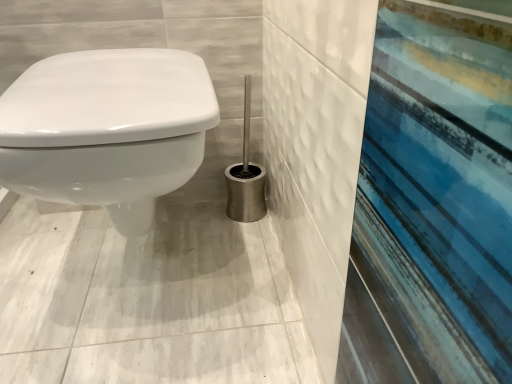
What do you see at coordinates (246, 177) in the screenshot?
I see `satin silver toilet brush at center` at bounding box center [246, 177].

Locate an element on the screen. This screenshot has width=512, height=384. satin silver toilet brush at center is located at coordinates (246, 177).

Where is `white glossy toilet at left`? The width and height of the screenshot is (512, 384). white glossy toilet at left is located at coordinates (106, 129).

In order to face white glossy toilet at left, should I rotate leftwards or rightwards?

Turn left approximately 17.132 degrees to face it.

What do you see at coordinates (106, 129) in the screenshot? Image resolution: width=512 pixels, height=384 pixels. I see `white glossy toilet at left` at bounding box center [106, 129].

The image size is (512, 384). I want to click on satin silver toilet brush at center, so click(246, 177).

From the picture: Considering the relative positions of white glossy toilet at left and satin silver toilet brush at center in the image provided, is white glossy toilet at left to the left of satin silver toilet brush at center from the viewer's perspective?

Yes.

In the image, is white glossy toilet at left positioned in front of or behind satin silver toilet brush at center?

Visually, white glossy toilet at left is located in front of satin silver toilet brush at center.

Considering the points (25, 170) and (246, 136), which point is in front, point (25, 170) or point (246, 136)?

The point (25, 170) is closer to the camera.

From the image's perspective, relative to satin silver toilet brush at center, is white glossy toilet at left above or below?

white glossy toilet at left is situated lower than satin silver toilet brush at center in the image.

From a real-world perspective, is white glossy toilet at left physically below satin silver toilet brush at center?

No, from a real-world perspective, white glossy toilet at left is not below satin silver toilet brush at center.

Between white glossy toilet at left and satin silver toilet brush at center, which one has larger width?

white glossy toilet at left.

Is white glossy toilet at left taller than satin silver toilet brush at center?

Yes.

Does white glossy toilet at left have a smaller size compared to satin silver toilet brush at center?

Actually, white glossy toilet at left might be larger than satin silver toilet brush at center.

Would you say white glossy toilet at left is inside or outside satin silver toilet brush at center?

white glossy toilet at left is located beyond the bounds of satin silver toilet brush at center.

Is white glossy toilet at left with satin silver toilet brush at center?

white glossy toilet at left and satin silver toilet brush at center are clearly separated.

Is white glossy toilet at left turned away from satin silver toilet brush at center?

No, white glossy toilet at left is not facing the opposite direction of satin silver toilet brush at center.

Can you tell me how much white glossy toilet at left and satin silver toilet brush at center differ in facing direction?

They differ by 1.31 degrees in their facing directions.

Measure the distance from white glossy toilet at left to satin silver toilet brush at center.

They are 16.76 inches apart.

At what (x,y) coordinates should I click in order to perform the action: click on toilet above the satin silver toilet brush at center (from a real-world perspective). Please return your answer as a coordinate pair (x, y). The width and height of the screenshot is (512, 384). Looking at the image, I should click on (106, 129).

Based on their positions, is satin silver toilet brush at center located to the left or right of white glossy toilet at left?

satin silver toilet brush at center is to the right of white glossy toilet at left.

Does satin silver toilet brush at center lie behind white glossy toilet at left?

Yes, satin silver toilet brush at center is further from the camera.

Between point (246, 195) and point (129, 110), which one is positioned behind?

The point (246, 195) is farther.

From the image's perspective, which object appears higher, satin silver toilet brush at center or white glossy toilet at left?

satin silver toilet brush at center appears higher in the image.

From a real-world perspective, which is physically above, satin silver toilet brush at center or white glossy toilet at left?

white glossy toilet at left, from a real-world perspective.

Considering the sizes of satin silver toilet brush at center and white glossy toilet at left in the image, is satin silver toilet brush at center wider or thinner than white glossy toilet at left?

satin silver toilet brush at center is thinner than white glossy toilet at left.

Considering the sizes of objects satin silver toilet brush at center and white glossy toilet at left in the image provided, who is taller, satin silver toilet brush at center or white glossy toilet at left?

white glossy toilet at left is taller.

Between satin silver toilet brush at center and white glossy toilet at left, which one has larger size?

Bigger between the two is white glossy toilet at left.

Can white glossy toilet at left be found inside satin silver toilet brush at center?

No, satin silver toilet brush at center does not contain white glossy toilet at left.

Is there a large distance between satin silver toilet brush at center and white glossy toilet at left?

Actually, satin silver toilet brush at center and white glossy toilet at left are a little close together.

Is satin silver toilet brush at center facing towards white glossy toilet at left?

No.

How different are the orientations of satin silver toilet brush at center and white glossy toilet at left in degrees?

1.31 degrees separate the facing orientations of satin silver toilet brush at center and white glossy toilet at left.

I want to click on toilet in front of the satin silver toilet brush at center, so point(106,129).

This screenshot has height=384, width=512. I want to click on brush on the right of white glossy toilet at left, so click(246, 177).

At what (x,y) coordinates should I click in order to perform the action: click on brush above the white glossy toilet at left (from the image's perspective). Please return your answer as a coordinate pair (x, y). This screenshot has height=384, width=512. Looking at the image, I should click on (246, 177).